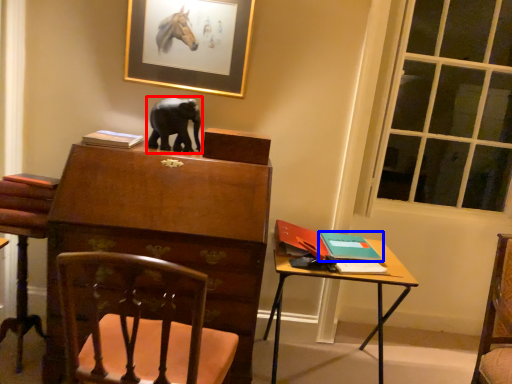
Question: Which point is closer to the camera, elephant (highlighted by a red box) or book (highlighted by a blue box)?

Choices:
 (A) elephant
 (B) book

Answer: (B)